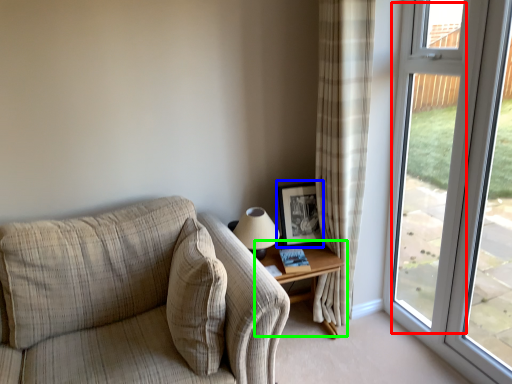
Question: Based on their relative distances, which object is farther from screen door (highlighted by a red box)? Choose from picture frame (highlighted by a blue box) and table (highlighted by a green box).

Choices:
 (A) picture frame
 (B) table

Answer: (B)